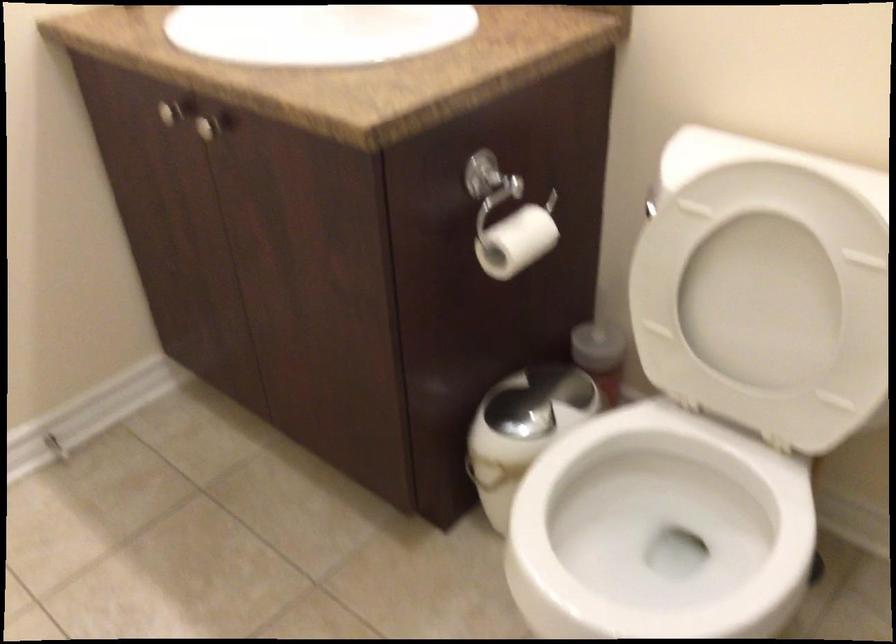
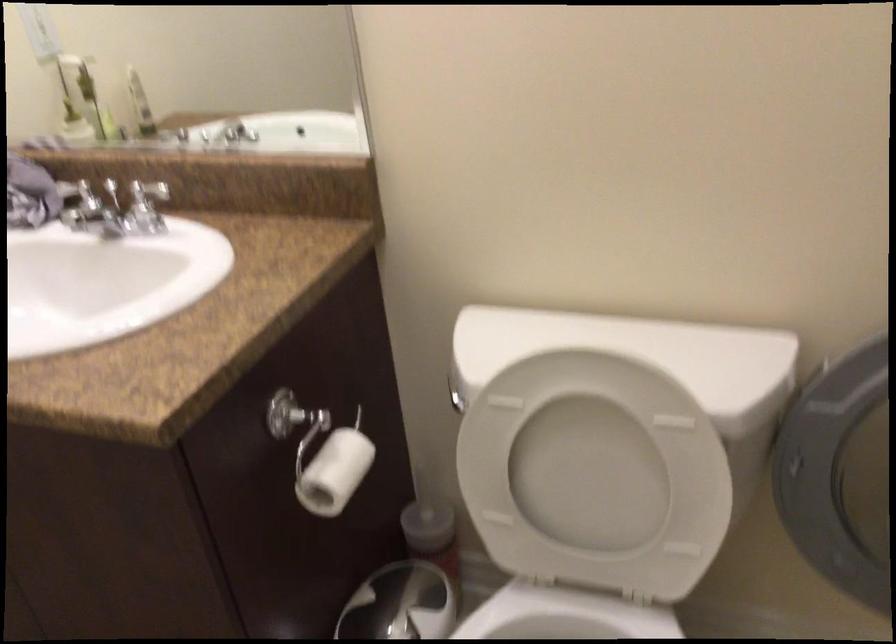
Question: Based on the continuous images, in which direction is the camera rotating? Reply with the corresponding letter.

Choices:
 (A) Left
 (B) Right
 (C) Up
 (D) Down

Answer: (B)